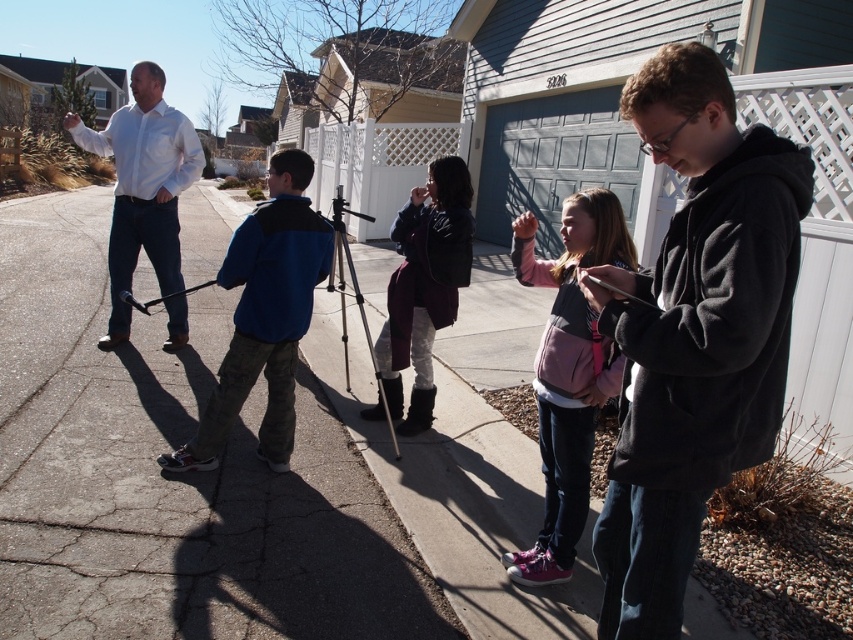
Question: Is concrete sidewalk at center further to the viewer compared to maroon fuzzy jacket at center?

Choices:
 (A) yes
 (B) no

Answer: (B)

Question: Which point is closer to the camera?

Choices:
 (A) dark gray fleece jacket at center right
 (B) camouflage pants at left
 (C) maroon fuzzy jacket at center

Answer: (A)

Question: Among these objects, which one is nearest to the camera?

Choices:
 (A) pink fleece jacket at center
 (B) camouflage pants at left
 (C) dark gray fleece jacket at center right
 (D) concrete sidewalk at center

Answer: (C)

Question: From the image, what is the correct spatial relationship of pink fleece jacket at center in relation to camouflage pants at left?

Choices:
 (A) right
 (B) left

Answer: (A)

Question: Which point appears farthest from the camera in this image?

Choices:
 (A) (228, 344)
 (B) (381, 340)
 (C) (177, 141)
 (D) (689, 320)

Answer: (C)

Question: Can you confirm if concrete sidewalk at center is thinner than dark gray fleece jacket at center right?

Choices:
 (A) no
 (B) yes

Answer: (A)